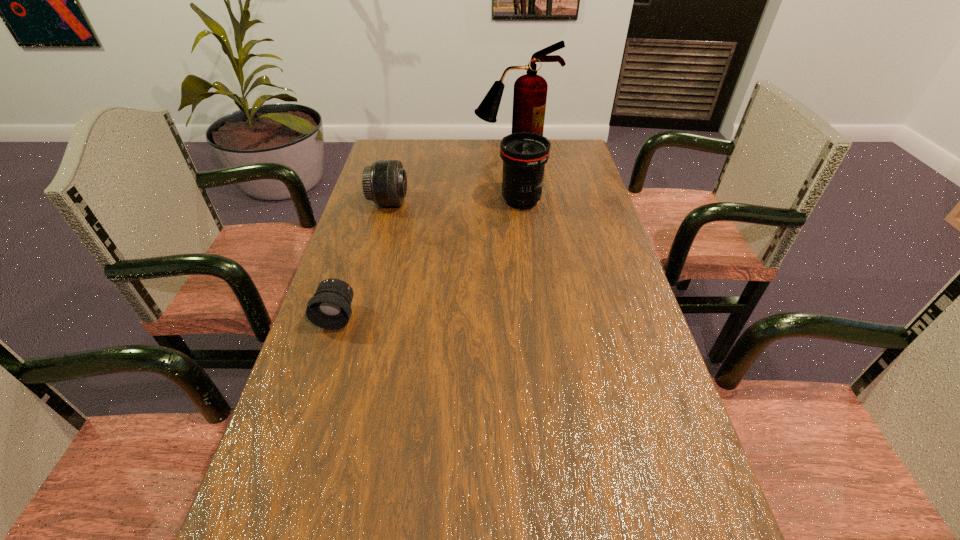
Where is `vacant area situated at the front element of the nearest telephoto lens`? vacant area situated at the front element of the nearest telephoto lens is located at coordinates (279, 496).

Image resolution: width=960 pixels, height=540 pixels. I want to click on object that is at the far edge, so click(530, 90).

What are the coordinates of `object present at the right edge` in the screenshot? It's located at (530, 90).

Image resolution: width=960 pixels, height=540 pixels. What are the coordinates of `object situated at the far right corner` in the screenshot? It's located at pos(530,90).

I want to click on blank space at the far edge of the desktop, so (466, 160).

Where is `vacant space at the left edge`? The image size is (960, 540). vacant space at the left edge is located at coordinates (326, 397).

In the image, there is a desktop. At what (x,y) coordinates should I click in order to perform the action: click on vacant region at the right edge. Please return your answer as a coordinate pair (x, y). The width and height of the screenshot is (960, 540). Looking at the image, I should click on point(570,184).

In the image, there is a desktop. Identify the location of vacant space at the far left corner. The image size is (960, 540). (384, 144).

At what (x,y) coordinates should I click in order to perform the action: click on free space at the far right corner of the desktop. Please return your answer as a coordinate pair (x, y). Looking at the image, I should click on [569, 160].

Locate an element on the screen. The image size is (960, 540). free space between the nearest telephoto lens and the second shortest object is located at coordinates (363, 259).